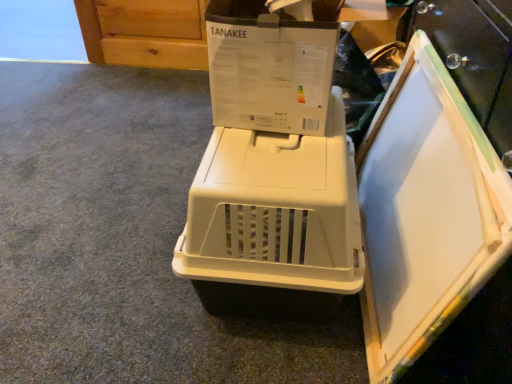
Image resolution: width=512 pixels, height=384 pixels. Find the location of `free point to the left of beige plastic pet carrier at center`. free point to the left of beige plastic pet carrier at center is located at coordinates (102, 296).